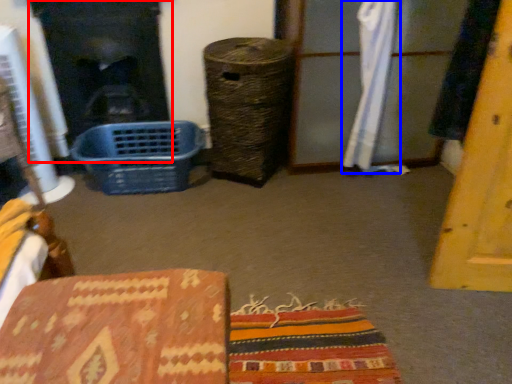
Question: Which object appears closest to the camera in this image, fireplace (highlighted by a red box) or curtain (highlighted by a blue box)?

Choices:
 (A) fireplace
 (B) curtain

Answer: (B)